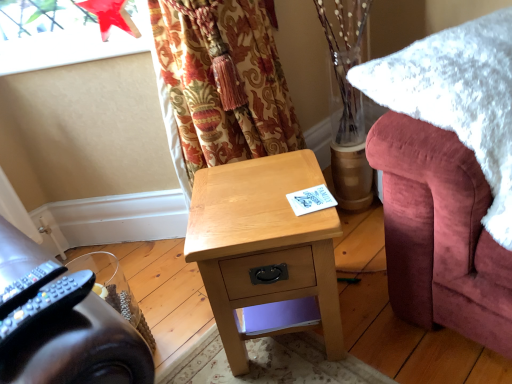
Question: From the image's perspective, is black plastic remote control at lower left, the 2th remote control from the left, over transparent glass window screen at upper left?

Choices:
 (A) no
 (B) yes

Answer: (A)

Question: Is black plastic remote control at lower left, placed as the 1th remote control when sorted from right to left, with transparent glass window screen at upper left?

Choices:
 (A) no
 (B) yes

Answer: (A)

Question: Can you confirm if black plastic remote control at lower left, placed as the 1th remote control when sorted from right to left, is wider than transparent glass window screen at upper left?

Choices:
 (A) no
 (B) yes

Answer: (A)

Question: Is black plastic remote control at lower left, the 2th remote control from the left, not within transparent glass window screen at upper left?

Choices:
 (A) no
 (B) yes

Answer: (B)

Question: Is black plastic remote control at lower left, the 2th remote control from the left, facing towards transparent glass window screen at upper left?

Choices:
 (A) yes
 (B) no

Answer: (B)

Question: Would you say light wood desk at center is inside or outside black plastic remote control at lower left, the first remote control from the left?

Choices:
 (A) inside
 (B) outside

Answer: (B)

Question: In terms of height, does light wood desk at center look taller or shorter compared to black plastic remote control at lower left, the first remote control from the left?

Choices:
 (A) tall
 (B) short

Answer: (A)

Question: Is light wood desk at center bigger or smaller than black plastic remote control at lower left, which is counted as the 2th remote control, starting from the right?

Choices:
 (A) small
 (B) big

Answer: (B)

Question: Is light wood desk at center wider or thinner than black plastic remote control at lower left, the first remote control from the left?

Choices:
 (A) thin
 (B) wide

Answer: (B)

Question: Which is correct: transparent glass window screen at upper left is inside white fluffy blanket at right, or outside of it?

Choices:
 (A) outside
 (B) inside

Answer: (A)

Question: In terms of size, does transparent glass window screen at upper left appear bigger or smaller than white fluffy blanket at right?

Choices:
 (A) small
 (B) big

Answer: (A)

Question: From a real-world perspective, relative to white fluffy blanket at right, is transparent glass window screen at upper left vertically above or below?

Choices:
 (A) below
 (B) above

Answer: (B)

Question: From their relative heights in the image, would you say transparent glass window screen at upper left is taller or shorter than white fluffy blanket at right?

Choices:
 (A) short
 (B) tall

Answer: (A)

Question: Is black plastic remote control at lower left, the first remote control from the left, bigger or smaller than white fluffy blanket at right?

Choices:
 (A) small
 (B) big

Answer: (A)

Question: Is black plastic remote control at lower left, the first remote control from the left, to the left or to the right of white fluffy blanket at right in the image?

Choices:
 (A) right
 (B) left

Answer: (B)